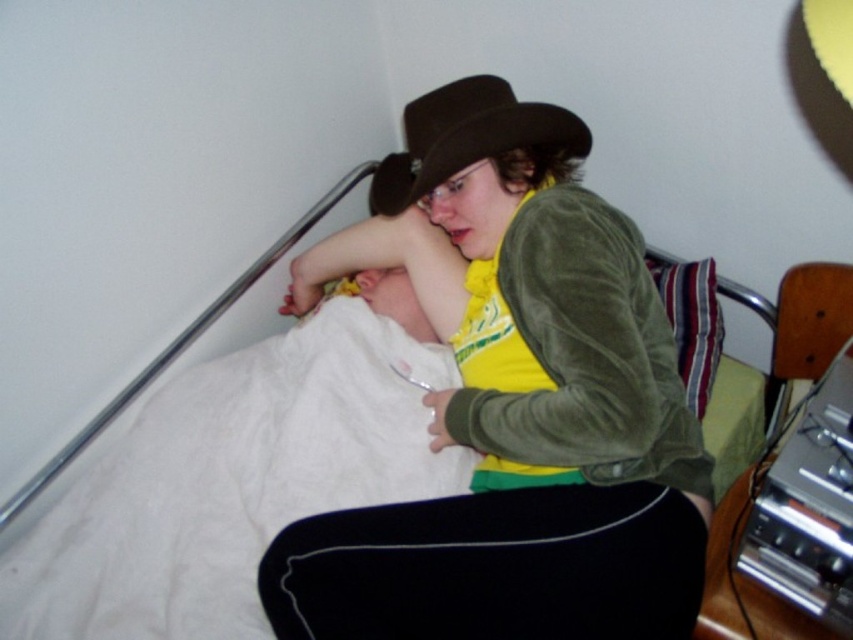
This screenshot has height=640, width=853. What do you see at coordinates (230, 483) in the screenshot?
I see `white soft blanket at upper left` at bounding box center [230, 483].

Between point (177, 460) and point (440, 513), which one is positioned behind?

Positioned behind is point (177, 460).

Locate an element on the screen. The image size is (853, 640). white soft blanket at upper left is located at coordinates (230, 483).

The width and height of the screenshot is (853, 640). What are the coordinates of `white soft blanket at upper left` in the screenshot? It's located at (230, 483).

Consider the image. Measure the distance from brown felt fedora at upper center to striped fabric pillow at upper right.

brown felt fedora at upper center is 15.56 inches from striped fabric pillow at upper right.

Does point (412, 177) come closer to viewer compared to point (689, 369)?

No, it is behind (689, 369).

Does point (412, 170) lie behind point (706, 301)?

No, it is in front of (706, 301).

The width and height of the screenshot is (853, 640). In order to click on brown felt fedora at upper center in this screenshot , I will do `click(468, 138)`.

Between black fabric at lower center and brown felt fedora at upper center, which one has less height?

black fabric at lower center

Does black fabric at lower center have a lesser width compared to brown felt fedora at upper center?

No, black fabric at lower center is not thinner than brown felt fedora at upper center.

Does point (387, 552) lie behind point (419, 136)?

No, it is not.

This screenshot has height=640, width=853. What are the coordinates of `black fabric at lower center` in the screenshot? It's located at [492, 566].